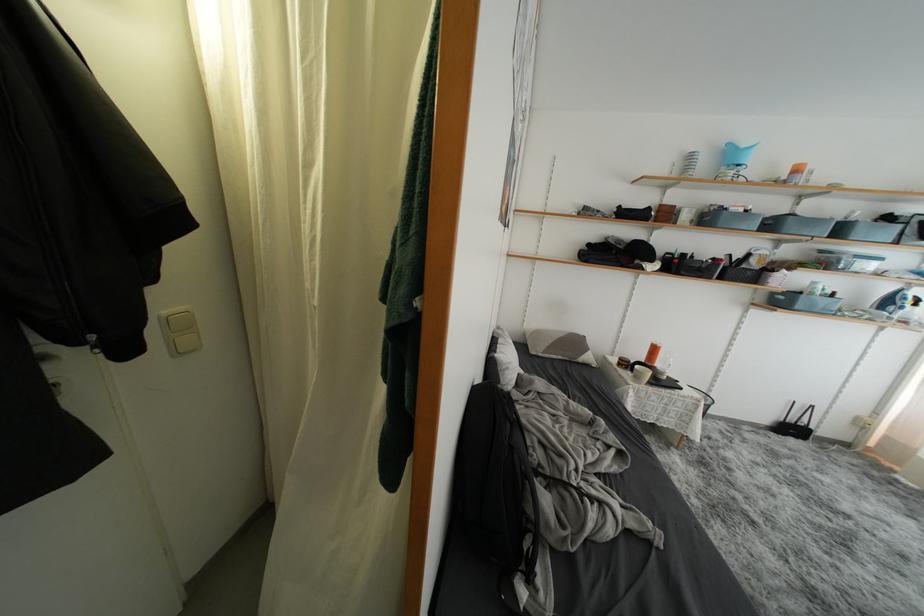
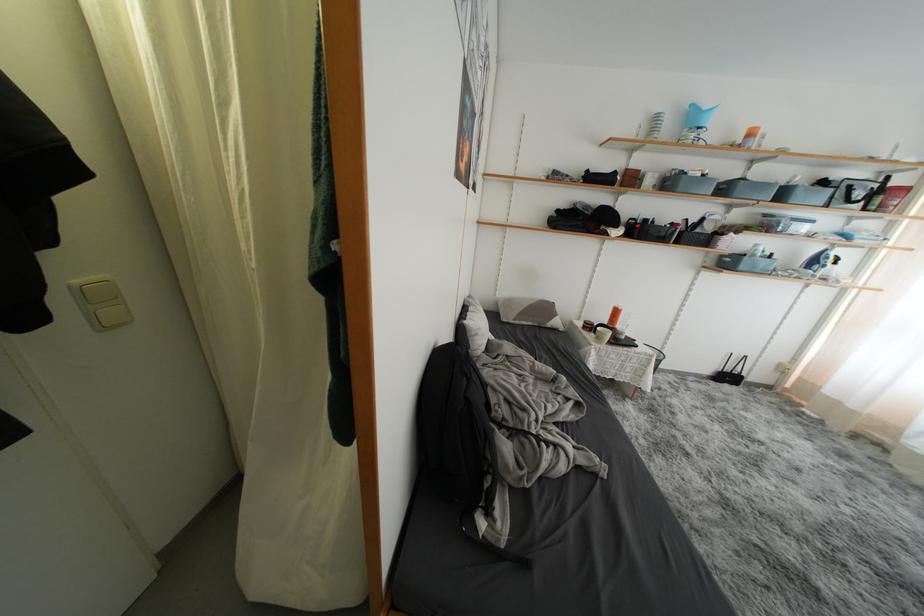
Question: What movement of the cameraman would produce the second image?

Choices:
 (A) Left
 (B) Right
 (C) Forward
 (D) Backward

Answer: (B)